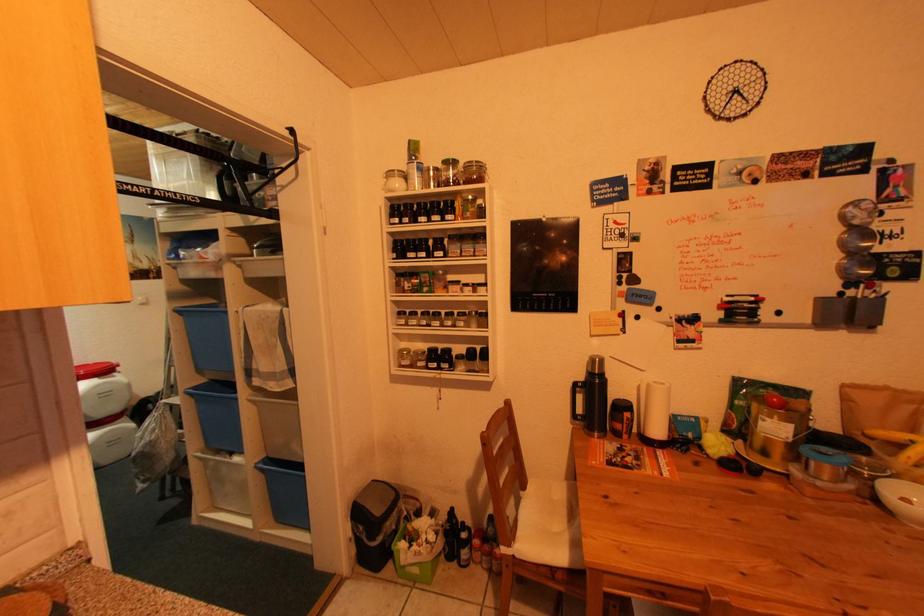
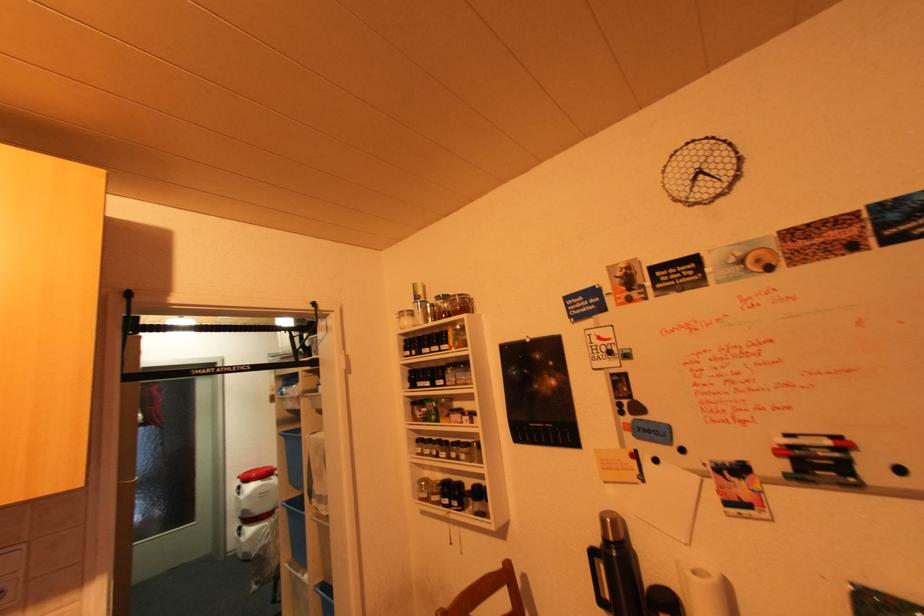
The first image is from the beginning of the video and the second image is from the end. How did the camera likely rotate when shooting the video?

The rotation direction of the camera is left-up.